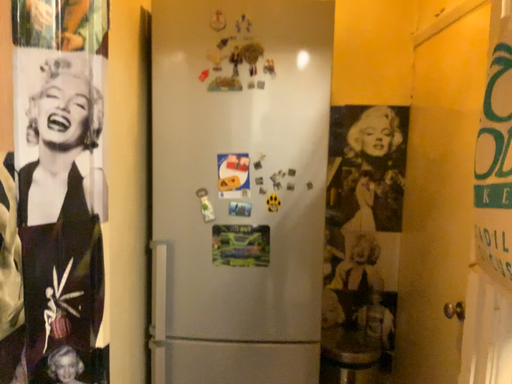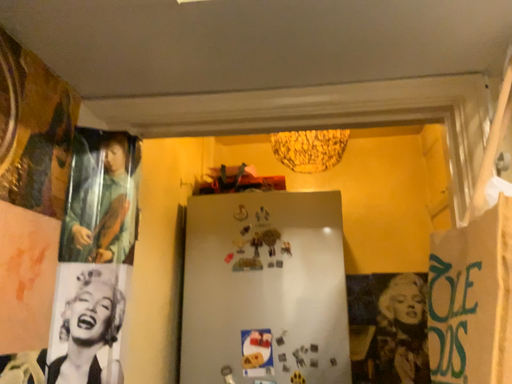
Question: Which way did the camera rotate in the video?

Choices:
 (A) rotated upward
 (B) rotated downward

Answer: (A)